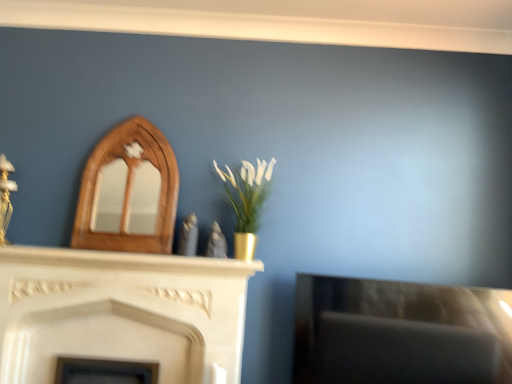
Image resolution: width=512 pixels, height=384 pixels. I want to click on white marble mantle at center, so click(x=128, y=261).

Locate an element on the screen. The image size is (512, 384). white marble fireplace at center, the 2th fireplace positioned from the top is located at coordinates (121, 313).

Where is `wooden mirror at upper left, which is the first fireplace in top-to-bottom order`? The image size is (512, 384). wooden mirror at upper left, which is the first fireplace in top-to-bottom order is located at coordinates (127, 192).

This screenshot has width=512, height=384. What are the coordinates of `white marble mantle at center` in the screenshot? It's located at (128, 261).

Between white marble fireplace at center, which ranks as the first fireplace in bottom-to-top order, and wooden mirror at upper left, placed as the 2th fireplace when sorted from bottom to top, which one has larger width?

white marble fireplace at center, which ranks as the first fireplace in bottom-to-top order, is wider.

Locate an element on the screen. fireplace above the white marble fireplace at center, which ranks as the first fireplace in bottom-to-top order (from a real-world perspective) is located at coordinates click(x=127, y=192).

From a real-world perspective, is white marble fireplace at center, which ranks as the first fireplace in bottom-to-top order, located beneath wooden mirror at upper left, placed as the 2th fireplace when sorted from bottom to top?

Yes, from a real-world perspective, white marble fireplace at center, which ranks as the first fireplace in bottom-to-top order, is under wooden mirror at upper left, placed as the 2th fireplace when sorted from bottom to top.

From the picture: Is white marble fireplace at center, the 2th fireplace positioned from the top, positioned with its back to wooden mirror at upper left, placed as the 2th fireplace when sorted from bottom to top?

No, wooden mirror at upper left, placed as the 2th fireplace when sorted from bottom to top, is not at the back of white marble fireplace at center, the 2th fireplace positioned from the top.

From a real-world perspective, who is located lower, white marble mantle at center or white marble fireplace at center, which ranks as the first fireplace in bottom-to-top order?

From a 3D spatial view, white marble fireplace at center, which ranks as the first fireplace in bottom-to-top order, is below.

Who is shorter, white marble mantle at center or white marble fireplace at center, the 2th fireplace positioned from the top?

white marble mantle at center is shorter.

Is white marble mantle at center oriented towards white marble fireplace at center, which ranks as the first fireplace in bottom-to-top order?

No, white marble mantle at center is not facing towards white marble fireplace at center, which ranks as the first fireplace in bottom-to-top order.

Is point (220, 269) more distant than point (198, 358)?

No, (220, 269) is closer to viewer.

How different are the orientations of gold metallic vase at center and white marble fireplace at center, the 2th fireplace positioned from the top, in degrees?

There is a 0.362-degree angle between the facing directions of gold metallic vase at center and white marble fireplace at center, the 2th fireplace positioned from the top.

Which of these two, gold metallic vase at center or white marble fireplace at center, the 2th fireplace positioned from the top, is thinner?

white marble fireplace at center, the 2th fireplace positioned from the top.

Locate an element on the screen. This screenshot has height=384, width=512. fireplace that is the 2nd object to the left of the gold metallic vase at center, starting at the anchor is located at coordinates (121, 313).

Considering the positions of objects gold metallic vase at center and white marble fireplace at center, the 2th fireplace positioned from the top, in the image provided, who is more to the right, gold metallic vase at center or white marble fireplace at center, the 2th fireplace positioned from the top,?

gold metallic vase at center is more to the right.

From a real-world perspective, which is physically below, wooden mirror at upper left, placed as the 2th fireplace when sorted from bottom to top, or white marble fireplace at center, the 2th fireplace positioned from the top?

white marble fireplace at center, the 2th fireplace positioned from the top, is physically lower.

From the image's perspective, is wooden mirror at upper left, which is the first fireplace in top-to-bottom order, below white marble fireplace at center, which ranks as the first fireplace in bottom-to-top order?

No, from the image's perspective, wooden mirror at upper left, which is the first fireplace in top-to-bottom order, is not beneath white marble fireplace at center, which ranks as the first fireplace in bottom-to-top order.

Which object is thinner, wooden mirror at upper left, placed as the 2th fireplace when sorted from bottom to top, or white marble fireplace at center, which ranks as the first fireplace in bottom-to-top order?

wooden mirror at upper left, placed as the 2th fireplace when sorted from bottom to top, is thinner.

Can you confirm if wooden mirror at upper left, which is the first fireplace in top-to-bottom order, is positioned to the right of white marble fireplace at center, which ranks as the first fireplace in bottom-to-top order?

Yes.

Is point (243, 270) farther from viewer compared to point (240, 236)?

No.

Where is `mantle on the left of gold metallic vase at center`? The image size is (512, 384). mantle on the left of gold metallic vase at center is located at coordinates (128, 261).

How different are the orientations of white marble mantle at center and gold metallic vase at center in degrees?

There is a 0.259-degree angle between the facing directions of white marble mantle at center and gold metallic vase at center.

How far apart are white marble mantle at center and gold metallic vase at center?

15.34 inches.

Between white marble mantle at center and wooden mirror at upper left, which is the first fireplace in top-to-bottom order, which one is positioned in front?

white marble mantle at center.

In the scene shown: Would you say wooden mirror at upper left, which is the first fireplace in top-to-bottom order, is part of white marble mantle at center's contents?

No, wooden mirror at upper left, which is the first fireplace in top-to-bottom order, is not inside white marble mantle at center.

In the scene shown: From a real-world perspective, is white marble mantle at center on wooden mirror at upper left, placed as the 2th fireplace when sorted from bottom to top?

Incorrect, from a real-world perspective, white marble mantle at center is lower than wooden mirror at upper left, placed as the 2th fireplace when sorted from bottom to top.

Which is closer to the camera, (106,257) or (114,128)?

Point (106,257) is positioned closer to the camera compared to point (114,128).

Is gold metallic vase at center far away from wooden mirror at upper left, which is the first fireplace in top-to-bottom order?

No.

Could wooden mirror at upper left, which is the first fireplace in top-to-bottom order, be considered to be inside gold metallic vase at center?

No, gold metallic vase at center does not contain wooden mirror at upper left, which is the first fireplace in top-to-bottom order.

Does point (269, 192) come farther from viewer compared to point (124, 124)?

No, it is in front of (124, 124).

Does gold metallic vase at center appear on the left side of wooden mirror at upper left, placed as the 2th fireplace when sorted from bottom to top?

Incorrect, gold metallic vase at center is not on the left side of wooden mirror at upper left, placed as the 2th fireplace when sorted from bottom to top.

Where is `fireplace that appears on the right of white marble fireplace at center, the 2th fireplace positioned from the top`? The height and width of the screenshot is (384, 512). fireplace that appears on the right of white marble fireplace at center, the 2th fireplace positioned from the top is located at coordinates [127, 192].

You are a GUI agent. You are given a task and a screenshot of the screen. Output one action in this format:
    pyautogui.click(x=<x>, y=<y>)
    Task: Click on the fireplace directly beneath the white marble mantle at center (from a real-world perspective)
    The width and height of the screenshot is (512, 384).
    Given the screenshot: What is the action you would take?
    pyautogui.click(x=121, y=313)

From the image, which object appears to be nearer to white marble mantle at center, white marble fireplace at center, which ranks as the first fireplace in bottom-to-top order, or wooden mirror at upper left, placed as the 2th fireplace when sorted from bottom to top?

white marble fireplace at center, which ranks as the first fireplace in bottom-to-top order, is positioned closer to the anchor white marble mantle at center.

Estimate the real-world distances between objects in this image. Which object is closer to gold metallic vase at center, white marble fireplace at center, which ranks as the first fireplace in bottom-to-top order, or white marble mantle at center?

Based on the image, white marble mantle at center appears to be nearer to gold metallic vase at center.

Considering their positions, is white marble mantle at center positioned closer to white marble fireplace at center, the 2th fireplace positioned from the top, than wooden mirror at upper left, which is the first fireplace in top-to-bottom order?

white marble mantle at center.

When comparing their distances from white marble mantle at center, does wooden mirror at upper left, which is the first fireplace in top-to-bottom order, or gold metallic vase at center seem closer?

Among the two, wooden mirror at upper left, which is the first fireplace in top-to-bottom order, is located nearer to white marble mantle at center.

From the image, which object appears to be farther from gold metallic vase at center, white marble fireplace at center, the 2th fireplace positioned from the top, or wooden mirror at upper left, which is the first fireplace in top-to-bottom order?

white marble fireplace at center, the 2th fireplace positioned from the top, is positioned further to the anchor gold metallic vase at center.

Looking at the image, which one is located further to wooden mirror at upper left, placed as the 2th fireplace when sorted from bottom to top, white marble mantle at center or white marble fireplace at center, which ranks as the first fireplace in bottom-to-top order?

Based on the image, white marble fireplace at center, which ranks as the first fireplace in bottom-to-top order, appears to be further to wooden mirror at upper left, placed as the 2th fireplace when sorted from bottom to top.

From the image, which object appears to be nearer to wooden mirror at upper left, placed as the 2th fireplace when sorted from bottom to top, white marble fireplace at center, the 2th fireplace positioned from the top, or white marble mantle at center?

white marble mantle at center is positioned closer to the anchor wooden mirror at upper left, placed as the 2th fireplace when sorted from bottom to top.

Based on their spatial positions, is gold metallic vase at center or wooden mirror at upper left, placed as the 2th fireplace when sorted from bottom to top, further from white marble fireplace at center, the 2th fireplace positioned from the top?

gold metallic vase at center is further to white marble fireplace at center, the 2th fireplace positioned from the top.

Locate an element on the screen. The image size is (512, 384). fireplace situated between white marble mantle at center and gold metallic vase at center from left to right is located at coordinates (127, 192).

The height and width of the screenshot is (384, 512). I want to click on floral arrangement that lies between wooden mirror at upper left, which is the first fireplace in top-to-bottom order, and white marble fireplace at center, which ranks as the first fireplace in bottom-to-top order, from top to bottom, so click(247, 201).

Where is `mantle situated between white marble fireplace at center, the 2th fireplace positioned from the top, and gold metallic vase at center from left to right`? The width and height of the screenshot is (512, 384). mantle situated between white marble fireplace at center, the 2th fireplace positioned from the top, and gold metallic vase at center from left to right is located at coordinates (128, 261).

Where is `mantle between wooden mirror at upper left, placed as the 2th fireplace when sorted from bottom to top, and white marble fireplace at center, which ranks as the first fireplace in bottom-to-top order, in the vertical direction`? The image size is (512, 384). mantle between wooden mirror at upper left, placed as the 2th fireplace when sorted from bottom to top, and white marble fireplace at center, which ranks as the first fireplace in bottom-to-top order, in the vertical direction is located at coordinates (128, 261).